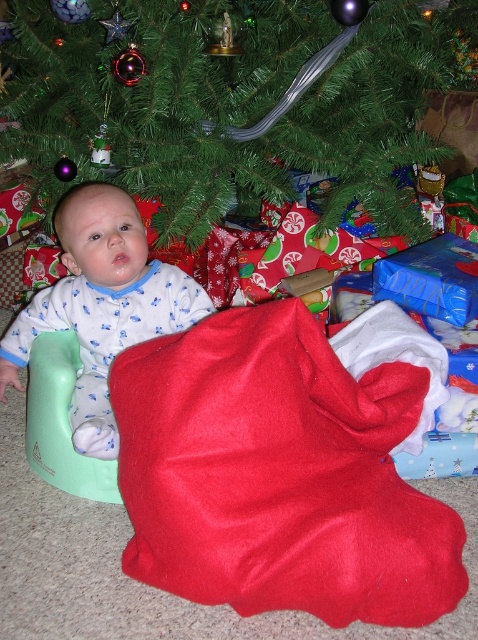
Can you confirm if red felt bag at lower center is positioned above green matte christmas tree at center?

No.

Which of these two, red felt bag at lower center or green matte christmas tree at center, stands taller?

green matte christmas tree at center

Identify the location of red felt bag at lower center. (286, 467).

Between matte blue pajamas at center and metallic silver ornament at upper center, which one has less height?

metallic silver ornament at upper center is shorter.

Is matte blue pajamas at center taller than metallic silver ornament at upper center?

Yes, matte blue pajamas at center is taller than metallic silver ornament at upper center.

The width and height of the screenshot is (478, 640). Find the location of `matte blue pajamas at center`. matte blue pajamas at center is located at coordinates (101, 305).

Identify the location of matte blue pajamas at center. (101, 305).

Which is more to the right, green matte christmas tree at center or green plastic chair at left?

Positioned to the right is green matte christmas tree at center.

Can you confirm if green matte christmas tree at center is shorter than green plastic chair at left?

In fact, green matte christmas tree at center may be taller than green plastic chair at left.

Locate an element on the screen. The image size is (478, 640). green matte christmas tree at center is located at coordinates (230, 100).

At what (x,y) coordinates should I click in order to perform the action: click on green matte christmas tree at center. Please return your answer as a coordinate pair (x, y). Image resolution: width=478 pixels, height=640 pixels. Looking at the image, I should click on (230, 100).